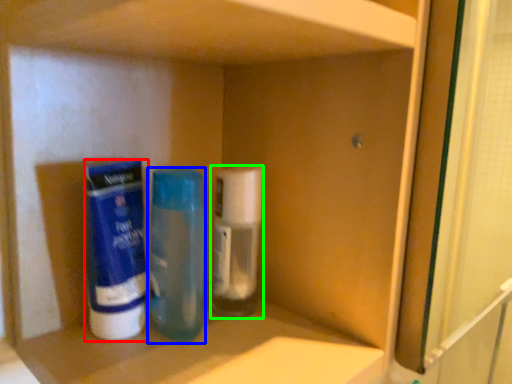
Question: Which object is the closest to the cleaning product (highlighted by a red box)? Choose among these: bottle (highlighted by a blue box) or bottle (highlighted by a green box).

Choices:
 (A) bottle
 (B) bottle

Answer: (A)